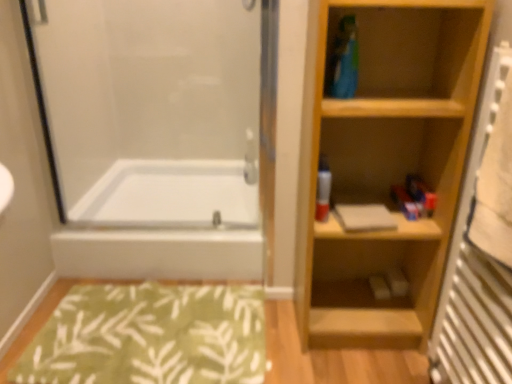
Question: From the image's perspective, is light wood bookshelf at right on wooden radiator at right?

Choices:
 (A) no
 (B) yes

Answer: (B)

Question: Is light wood bookshelf at right positioned far away from wooden radiator at right?

Choices:
 (A) yes
 (B) no

Answer: (B)

Question: Does light wood bookshelf at right contain wooden radiator at right?

Choices:
 (A) yes
 (B) no

Answer: (B)

Question: Is light wood bookshelf at right shorter than wooden radiator at right?

Choices:
 (A) yes
 (B) no

Answer: (B)

Question: Considering the relative sizes of light wood bookshelf at right and wooden radiator at right in the image provided, is light wood bookshelf at right taller than wooden radiator at right?

Choices:
 (A) yes
 (B) no

Answer: (A)

Question: Based on their sizes in the image, would you say wooden radiator at right is bigger or smaller than matte plastic spray can at center?

Choices:
 (A) small
 (B) big

Answer: (B)

Question: From a real-world perspective, is wooden radiator at right positioned above or below matte plastic spray can at center?

Choices:
 (A) above
 (B) below

Answer: (B)

Question: Looking at their shapes, would you say wooden radiator at right is wider or thinner than matte plastic spray can at center?

Choices:
 (A) thin
 (B) wide

Answer: (B)

Question: Is wooden radiator at right spatially inside matte plastic spray can at center, or outside of it?

Choices:
 (A) outside
 (B) inside

Answer: (A)

Question: Considering the positions of matte gray book at center and matte plastic spray can at center in the image, is matte gray book at center wider or thinner than matte plastic spray can at center?

Choices:
 (A) thin
 (B) wide

Answer: (B)

Question: Considering the relative positions of matte gray book at center and matte plastic spray can at center in the image provided, is matte gray book at center to the left or to the right of matte plastic spray can at center?

Choices:
 (A) left
 (B) right

Answer: (B)

Question: Looking at the image, does matte gray book at center seem bigger or smaller compared to matte plastic spray can at center?

Choices:
 (A) small
 (B) big

Answer: (B)

Question: Is matte gray book at center situated inside matte plastic spray can at center or outside?

Choices:
 (A) outside
 (B) inside

Answer: (A)

Question: Is wooden radiator at right wider or thinner than white glossy bathtub at lower left?

Choices:
 (A) wide
 (B) thin

Answer: (B)

Question: Based on their sizes in the image, would you say wooden radiator at right is bigger or smaller than white glossy bathtub at lower left?

Choices:
 (A) big
 (B) small

Answer: (B)